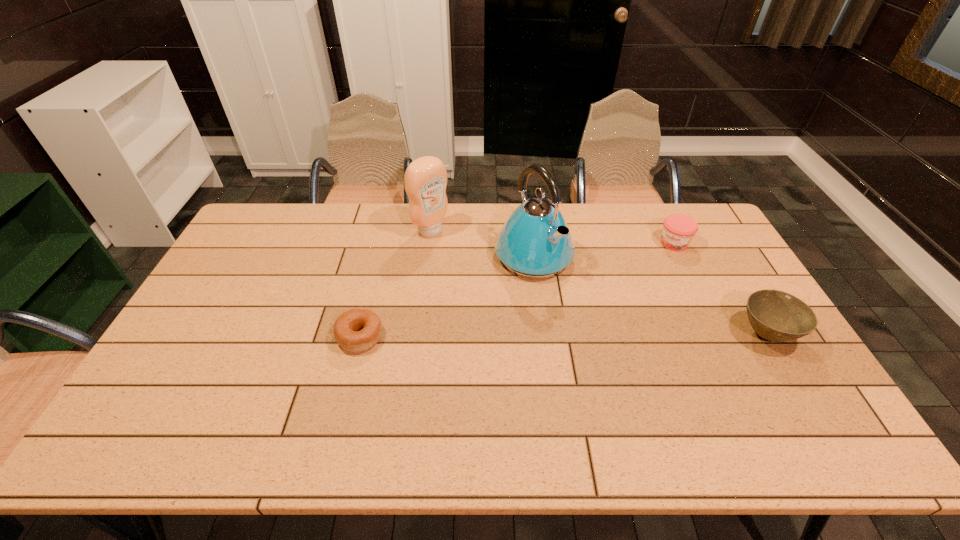
The image size is (960, 540). Identify the location of kettle that is at the far edge. (535, 242).

At what (x,y) coordinates should I click in order to perform the action: click on condiment positioned at the far edge. Please return your answer as a coordinate pair (x, y). This screenshot has height=540, width=960. Looking at the image, I should click on (425, 179).

This screenshot has height=540, width=960. Identify the location of bowl present at the right edge. (777, 316).

In order to click on jam at the right edge in this screenshot , I will do `click(678, 230)`.

Locate an element on the screen. The height and width of the screenshot is (540, 960). object present at the far right corner is located at coordinates (678, 230).

Locate an element on the screen. The image size is (960, 540). vacant area at the far edge is located at coordinates (409, 219).

You are a GUI agent. You are given a task and a screenshot of the screen. Output one action in this format:
    pyautogui.click(x=<x>, y=<y>)
    Task: Click on the vacant region at the near edge
    The image size is (960, 540).
    Given the screenshot: What is the action you would take?
    tap(406, 394)

In the image, there is a desktop. Identify the location of vacant space at the left edge. This screenshot has width=960, height=540. (262, 250).

I want to click on vacant region at the right edge of the desktop, so click(704, 282).

Where is `free point between the condiment and the tallest object`? The height and width of the screenshot is (540, 960). free point between the condiment and the tallest object is located at coordinates (482, 243).